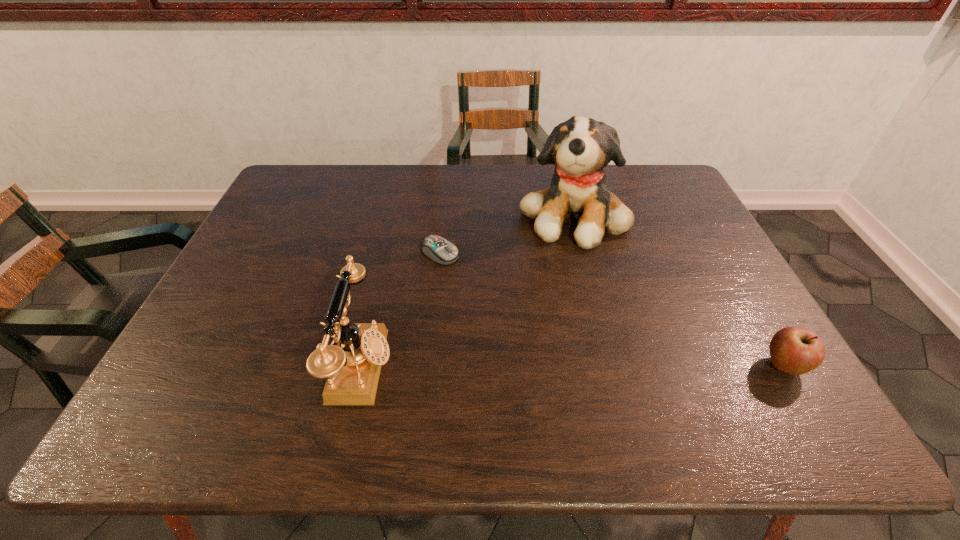
Locate an element on the screen. The image size is (960, 540). vacant area that lies between the leftmost object and the third tallest object is located at coordinates (573, 367).

Find the location of a particular element. free space between the apple and the computer mouse is located at coordinates (612, 310).

Identify the location of free space between the shortest object and the second tallest object. Image resolution: width=960 pixels, height=540 pixels. (401, 310).

The image size is (960, 540). Find the location of `free space between the shortest object and the telephone`. free space between the shortest object and the telephone is located at coordinates (401, 310).

This screenshot has width=960, height=540. What are the coordinates of `object that can be found as the second closest to the rightmost object` in the screenshot? It's located at (436, 248).

The width and height of the screenshot is (960, 540). What are the coordinates of `the closest object to the shortest object` in the screenshot? It's located at (580, 148).

In order to click on free location that satisfies the following two spatial constraints: 1. on the front side of the shortest object; 2. on the right side of the apple in this screenshot , I will do `click(429, 366)`.